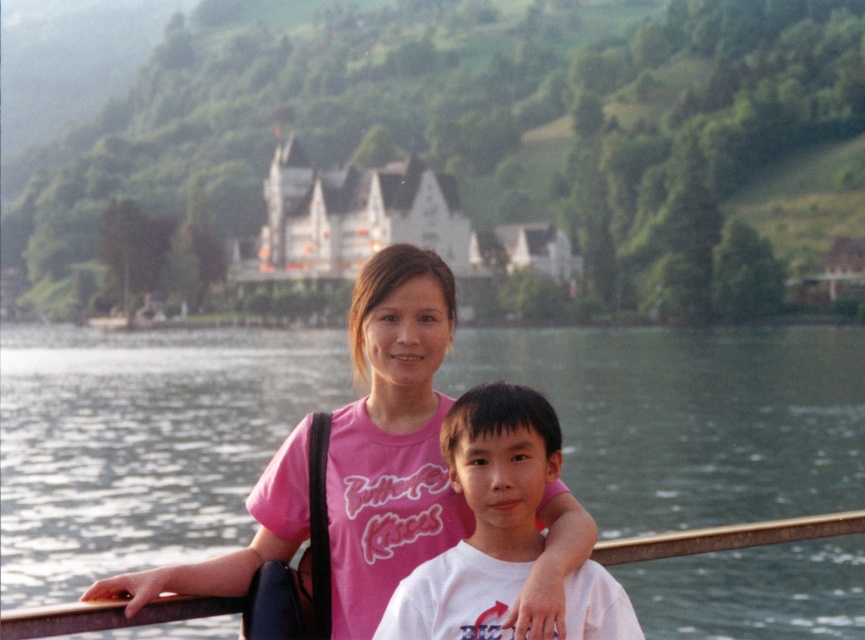
Question: Can you confirm if pink fabric shirt at center is positioned to the right of white cotton shirt at center?

Choices:
 (A) yes
 (B) no

Answer: (B)

Question: Which object is farther from the camera taking this photo?

Choices:
 (A) white cotton shirt at center
 (B) pink fabric shirt at center

Answer: (A)

Question: Can you confirm if pink fabric shirt at center is positioned above white cotton shirt at center?

Choices:
 (A) yes
 (B) no

Answer: (A)

Question: In this image, where is pink fabric shirt at center located relative to white cotton shirt at center?

Choices:
 (A) above
 (B) below

Answer: (A)

Question: Which of the following is the closest to the observer?

Choices:
 (A) white cotton shirt at center
 (B) pink fabric shirt at center

Answer: (B)

Question: Which point is closer to the camera?

Choices:
 (A) white cotton shirt at center
 (B) pink fabric shirt at center

Answer: (B)